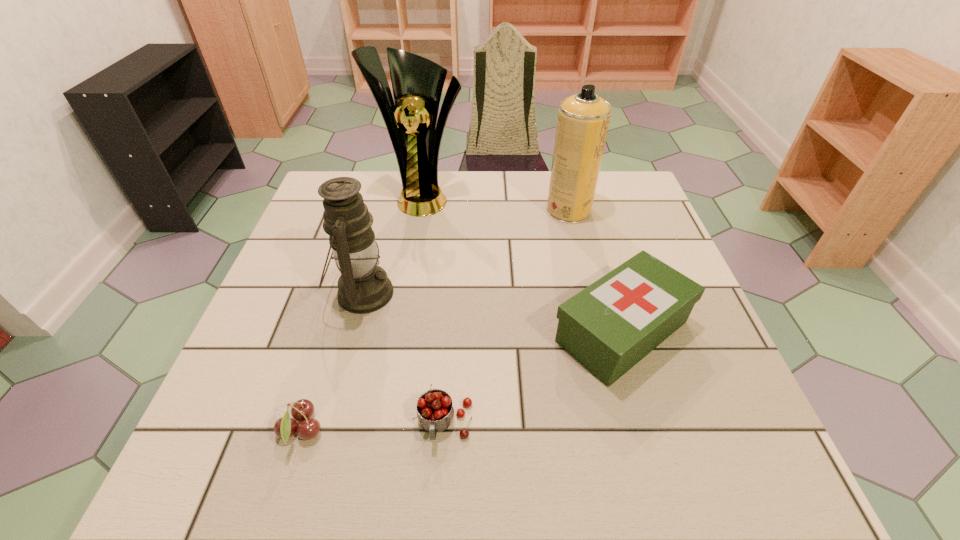
Locate an element on the screen. The image size is (960, 540). free space at the left edge of the desktop is located at coordinates (237, 438).

Where is `vacant space at the right edge`? The image size is (960, 540). vacant space at the right edge is located at coordinates (662, 345).

This screenshot has height=540, width=960. I want to click on unoccupied area between the third tallest object and the taller cherry, so click(x=404, y=359).

Locate an element on the screen. The width and height of the screenshot is (960, 540). free space that is in between the left cherry and the aerosol can is located at coordinates (435, 320).

This screenshot has height=540, width=960. Find the location of `empty space between the oil lamp and the shorter cherry`. empty space between the oil lamp and the shorter cherry is located at coordinates (332, 362).

Where is `free space that is in between the award and the right cherry`? The height and width of the screenshot is (540, 960). free space that is in between the award and the right cherry is located at coordinates (434, 310).

Find the location of a particular element. The width and height of the screenshot is (960, 540). free space between the first-aid kit and the shortest object is located at coordinates (462, 381).

You are a GUI agent. You are given a task and a screenshot of the screen. Output one action in this format:
    pyautogui.click(x=<x>, y=<y>)
    Task: Click on the vacant area between the shorter cherry and the third tallest object
    
    Given the screenshot: What is the action you would take?
    pyautogui.click(x=332, y=362)

This screenshot has width=960, height=540. Identify the location of vacant space that's between the shortest object and the oil lamp. (332, 362).

I want to click on unoccupied position between the shortest object and the aerosol can, so pyautogui.click(x=435, y=320).